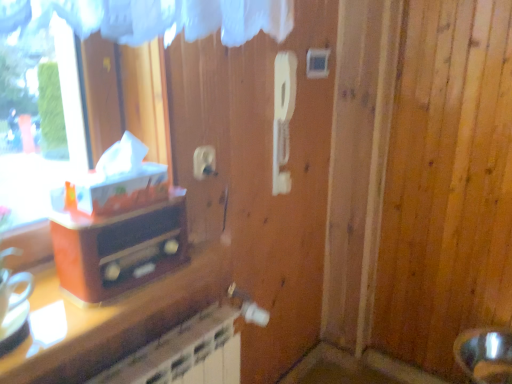
The height and width of the screenshot is (384, 512). I want to click on free location above matte orange radio at left (from a real-world perspective), so click(x=124, y=207).